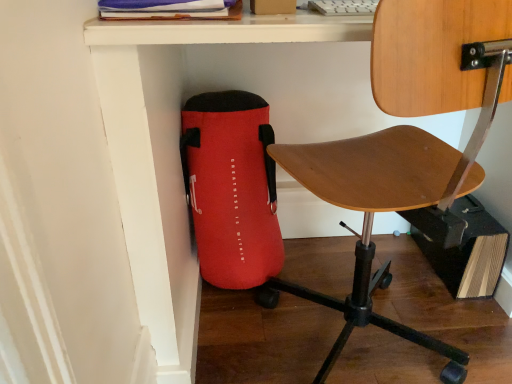
This screenshot has height=384, width=512. I want to click on vacant area located to the right-hand side of red fabric bag at lower left, so click(x=333, y=260).